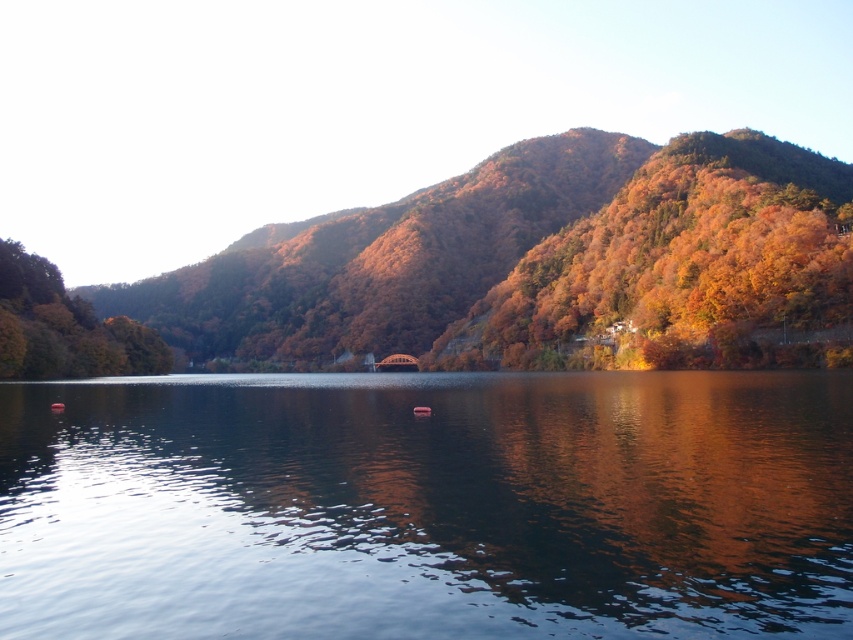
Who is taller, transparent water at center or autumn leaves at upper right?

autumn leaves at upper right

Is point (299, 636) closer to camera compared to point (843, 214)?

Yes, point (299, 636) is closer to viewer.

Which is behind, point (373, 627) or point (624, 342)?

The point (624, 342) is behind.

Find the location of a particular element. This screenshot has width=853, height=640. transparent water at center is located at coordinates (427, 506).

Is autumn leaves at upper right thinner than green matte tree at left?

In fact, autumn leaves at upper right might be wider than green matte tree at left.

Is autumn leaves at upper right positioned in front of green matte tree at left?

Yes, it is.

Does point (671, 266) come closer to viewer compared to point (10, 344)?

No.

Locate an element on the screen. Image resolution: width=853 pixels, height=640 pixels. autumn leaves at upper right is located at coordinates (682, 269).

Does transparent water at center have a greater width compared to green matte tree at left?

Correct, the width of transparent water at center exceeds that of green matte tree at left.

From the picture: Does transparent water at center have a larger size compared to green matte tree at left?

Actually, transparent water at center might be smaller than green matte tree at left.

Locate an element on the screen. The width and height of the screenshot is (853, 640). transparent water at center is located at coordinates (427, 506).